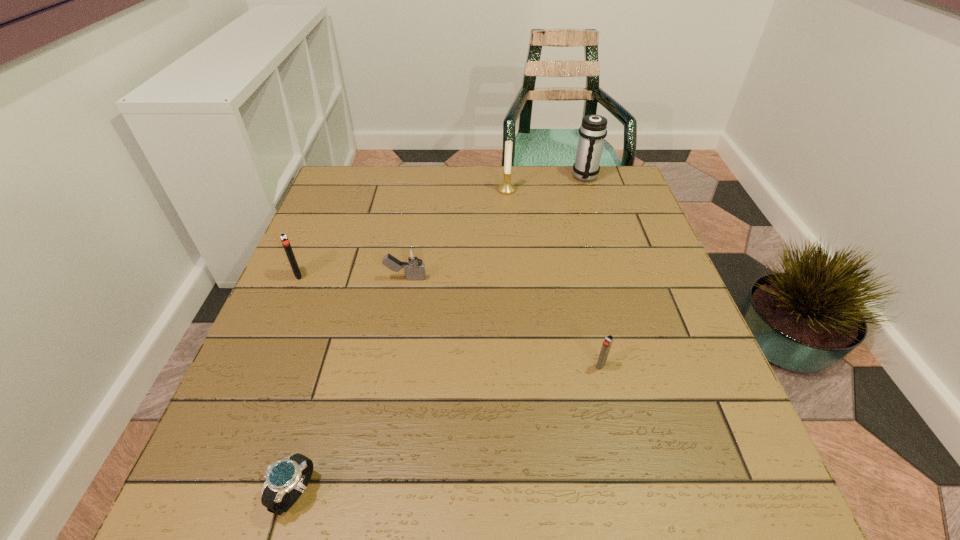
The height and width of the screenshot is (540, 960). Identify the location of watch located in the left edge section of the desktop. (291, 475).

Locate an element on the screen. object located in the right edge section of the desktop is located at coordinates click(593, 130).

The height and width of the screenshot is (540, 960). I want to click on object that is at the near left corner, so click(x=291, y=475).

Locate an element on the screen. object present at the far right corner is located at coordinates (x=593, y=130).

This screenshot has width=960, height=540. In the image, there is a desktop. In order to click on free space at the far edge in this screenshot , I will do `click(460, 205)`.

Locate an element on the screen. This screenshot has height=540, width=960. free space at the left edge is located at coordinates (349, 219).

Locate an element on the screen. The image size is (960, 540). free spot at the right edge of the desktop is located at coordinates (666, 449).

At what (x,y) coordinates should I click in order to perform the action: click on vacant space at the far left corner of the desktop. Please return your answer as a coordinate pair (x, y). The image size is (960, 540). Looking at the image, I should click on (374, 166).

This screenshot has height=540, width=960. In order to click on vacant region at the near left corner of the desktop in this screenshot , I will do `click(220, 474)`.

The width and height of the screenshot is (960, 540). In the image, there is a desktop. In order to click on vacant space at the far right corner in this screenshot , I will do `click(627, 209)`.